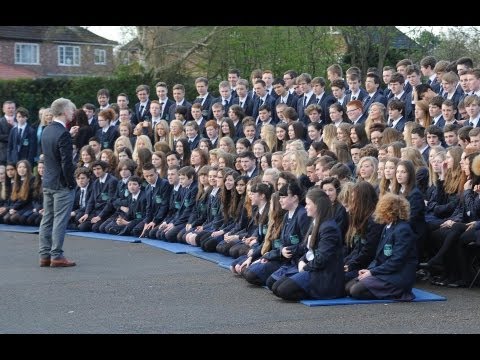
The height and width of the screenshot is (360, 480). I want to click on blue mats for people to kneel on, so click(x=13, y=228), click(x=95, y=236), click(x=206, y=255), click(x=223, y=264), click(x=307, y=300).